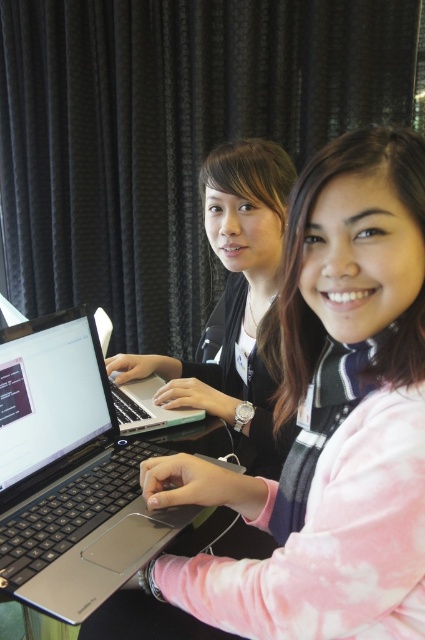
How distant is pink matte sweater at center from sleek silver laptop at center?

A distance of 20.40 inches exists between pink matte sweater at center and sleek silver laptop at center.

Between pink matte sweater at center and sleek silver laptop at center, which one has more height?

Standing taller between the two is pink matte sweater at center.

Measure the distance between point (223, 573) and camera.

They are 24.88 inches apart.

Find the location of a particular element. The height and width of the screenshot is (640, 425). pink matte sweater at center is located at coordinates (331, 419).

Locate an element on the screen. The width and height of the screenshot is (425, 640). silver metallic laptop at center is located at coordinates (68, 472).

Locate an element on the screen. The width and height of the screenshot is (425, 640). silver metallic laptop at center is located at coordinates (68, 472).

Does point (294, 534) come closer to viewer compared to point (180, 364)?

Yes.

Can you confirm if pink matte sweater at center is shorter than matte black laptop at center?

Yes.

Between point (206, 502) and point (266, 468), which one is positioned behind?

Positioned behind is point (266, 468).

Image resolution: width=425 pixels, height=640 pixels. I want to click on pink matte sweater at center, so click(331, 419).